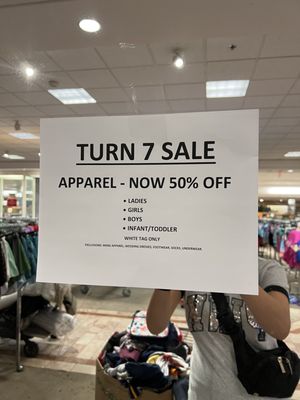
The height and width of the screenshot is (400, 300). Find the location of `smoke detector`. smoke detector is located at coordinates (54, 83).